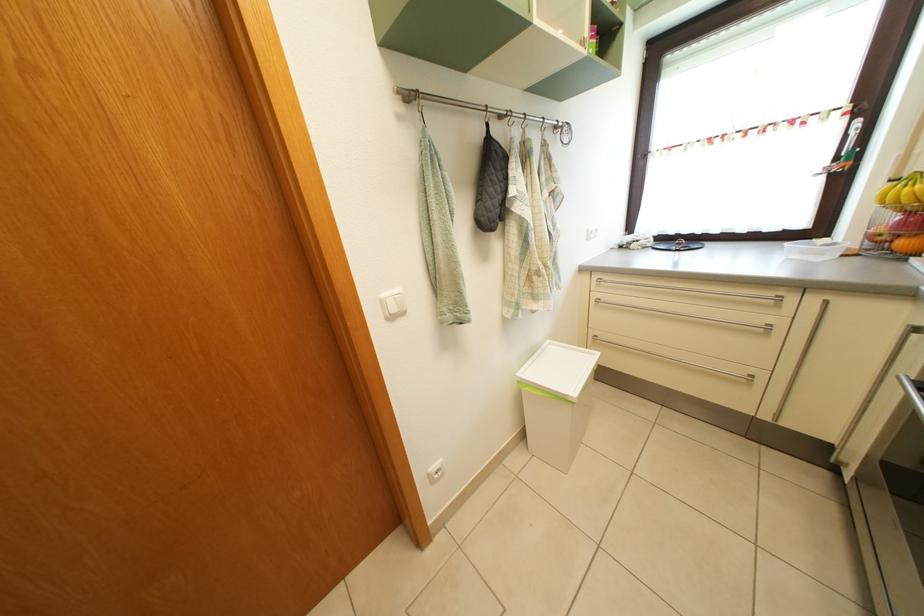
The image size is (924, 616). What do you see at coordinates (558, 369) in the screenshot?
I see `a white trash can lid` at bounding box center [558, 369].